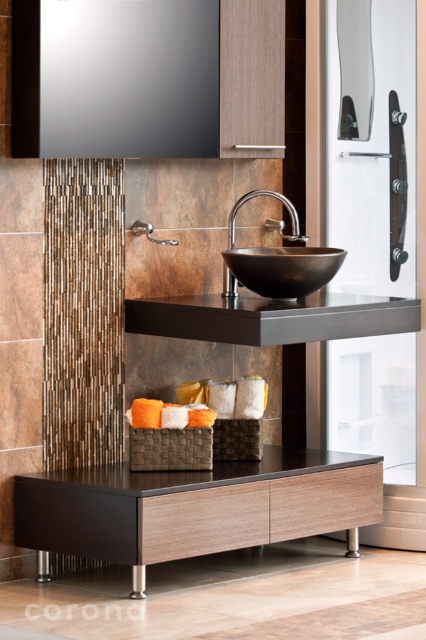
Question: Which of these objects is positioned closest to the satin nickel faucet at center?

Choices:
 (A) black polished bowl at center
 (B) matte black vanity at center

Answer: (A)

Question: Which object is closer to the camera taking this photo?

Choices:
 (A) matte black vanity at center
 (B) black polished bowl at center
 (C) satin nickel faucet at center

Answer: (A)

Question: Does matte black vanity at center appear on the right side of satin nickel faucet at center?

Choices:
 (A) no
 (B) yes

Answer: (A)

Question: Does black polished bowl at center appear over satin nickel faucet at center?

Choices:
 (A) yes
 (B) no

Answer: (B)

Question: Which point is closer to the camera?

Choices:
 (A) (325, 528)
 (B) (301, 236)
 (C) (226, 276)

Answer: (A)

Question: Does black polished bowl at center have a smaller size compared to satin nickel faucet at center?

Choices:
 (A) yes
 (B) no

Answer: (A)